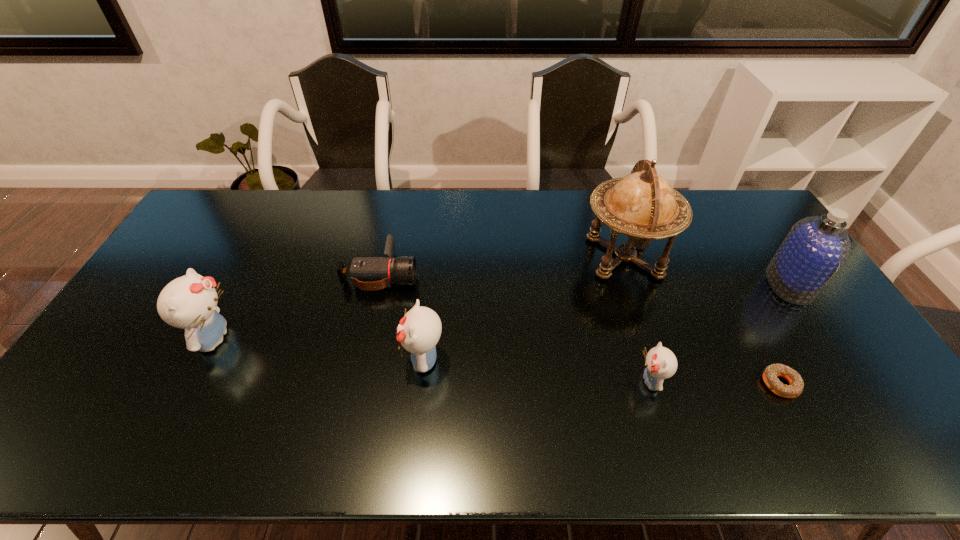
The width and height of the screenshot is (960, 540). What are the coordinates of `the sixth object from left to right` in the screenshot? It's located at (770, 374).

The height and width of the screenshot is (540, 960). What are the coordinates of `free space located on the front-facing side of the leftmost kitten` in the screenshot? It's located at (274, 339).

Locate an element on the screen. Image resolution: width=960 pixels, height=540 pixels. vacant region located on the front-facing side of the fourth shortest object is located at coordinates (347, 359).

You are a GUI agent. You are given a task and a screenshot of the screen. Output one action in this format:
    pyautogui.click(x=<x>, y=<y>)
    Task: Click on the vacant space located on the front-facing side of the fourth shortest object
    This screenshot has width=960, height=540.
    Given the screenshot: What is the action you would take?
    pyautogui.click(x=305, y=359)

The width and height of the screenshot is (960, 540). I want to click on blank space located 0.220m on the front-facing side of the fourth shortest object, so click(x=321, y=359).

Identify the location of free space located on the front-facing side of the rightmost kitten. (550, 381).

Find the location of a particular element. This screenshot has width=960, height=540. vacant position located 0.060m on the front-facing side of the rightmost kitten is located at coordinates (612, 381).

At what (x,y) coordinates should I click in order to perform the action: click on vacant space located on the front-facing side of the rightmost kitten. Please return your answer as a coordinate pair (x, y). Looking at the image, I should click on (542, 381).

Find the location of a particular element. The width and height of the screenshot is (960, 540). vacant area located on the front-facing side of the globe is located at coordinates (480, 258).

Locate an element on the screen. blank area located 0.400m on the front-facing side of the globe is located at coordinates (458, 258).